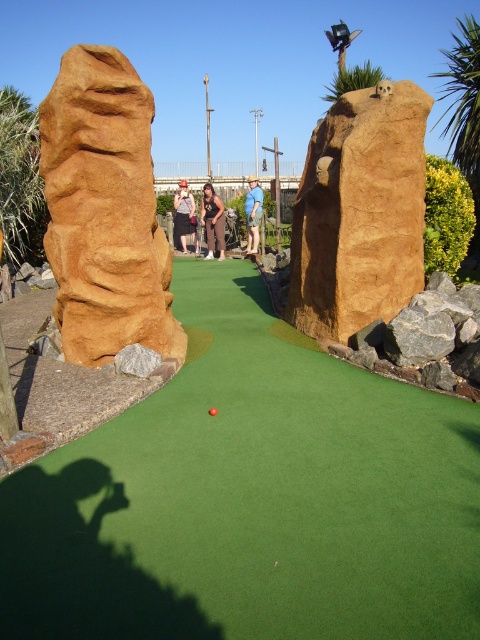
You are standing at the red golf ball near the center of the green. You want to hit the ball to the hole located at the point marked by the coordinates point (213,220). Which direction should you aim your shot?

You should aim your shot towards the brown leather pants at center, which is located at point (213,220).

In the scene shown: A miniature golf player wants to putt the ball from the green artificial turf at center to the brown leather pants at center. Given that the maximum distance they can hit is 25 feet, will they be able to reach the target in one shot?

The green artificial turf at center and brown leather pants at center are 28.73 feet apart. Since the maximum distance the player can hit is 25 feet, they will not be able to reach the target in one shot.

You are playing miniature golf and want to hit the red golf ball near the center onto the brown textured rock at center. The distance between them is 5.02 meters. If your putter can hit the ball up to 5 meters, will you be able to reach the rock in one shot?

The distance between the red golf ball near the center and the brown textured rock at center is 5.02 meters, which is slightly longer than the putter can hit. You will not be able to reach the rock in one shot with your current putter.